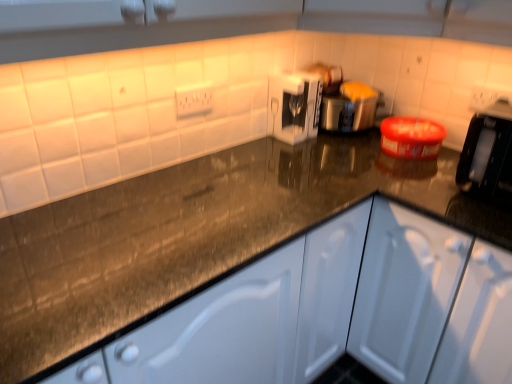
Question: Are satin silver toaster at center, the second appliance in the left-to-right sequence, and white glossy coffee machine at center, which appears as the first appliance when viewed from the left, beside each other?

Choices:
 (A) yes
 (B) no

Answer: (B)

Question: Is satin silver toaster at center, marked as the first appliance in a right-to-left arrangement, not close to white glossy coffee machine at center, which appears as the first appliance when viewed from the left?

Choices:
 (A) yes
 (B) no

Answer: (B)

Question: Considering the relative sizes of satin silver toaster at center, marked as the first appliance in a right-to-left arrangement, and white glossy coffee machine at center, which appears as the first appliance when viewed from the left, in the image provided, is satin silver toaster at center, marked as the first appliance in a right-to-left arrangement, shorter than white glossy coffee machine at center, which appears as the first appliance when viewed from the left,?

Choices:
 (A) no
 (B) yes

Answer: (A)

Question: From a real-world perspective, is satin silver toaster at center, marked as the first appliance in a right-to-left arrangement, on top of white glossy coffee machine at center, which appears as the first appliance when viewed from the left?

Choices:
 (A) no
 (B) yes

Answer: (B)

Question: Considering the relative positions of satin silver toaster at center, marked as the first appliance in a right-to-left arrangement, and white glossy coffee machine at center, placed as the second appliance when sorted from right to left, in the image provided, is satin silver toaster at center, marked as the first appliance in a right-to-left arrangement, to the left of white glossy coffee machine at center, placed as the second appliance when sorted from right to left, from the viewer's perspective?

Choices:
 (A) yes
 (B) no

Answer: (B)

Question: Can you confirm if satin silver toaster at center, the second appliance in the left-to-right sequence, is bigger than white glossy coffee machine at center, which appears as the first appliance when viewed from the left?

Choices:
 (A) no
 (B) yes

Answer: (B)

Question: Considering the relative positions of white plastic electric outlet at upper center and white glossy coffee machine at center, placed as the second appliance when sorted from right to left, in the image provided, is white plastic electric outlet at upper center in front of white glossy coffee machine at center, placed as the second appliance when sorted from right to left,?

Choices:
 (A) no
 (B) yes

Answer: (B)

Question: Considering the relative sizes of white plastic electric outlet at upper center and white glossy coffee machine at center, which appears as the first appliance when viewed from the left, in the image provided, is white plastic electric outlet at upper center smaller than white glossy coffee machine at center, which appears as the first appliance when viewed from the left,?

Choices:
 (A) no
 (B) yes

Answer: (B)

Question: Is white plastic electric outlet at upper center not near white glossy coffee machine at center, which appears as the first appliance when viewed from the left?

Choices:
 (A) yes
 (B) no

Answer: (B)

Question: Would you say white plastic electric outlet at upper center is outside white glossy coffee machine at center, which appears as the first appliance when viewed from the left?

Choices:
 (A) yes
 (B) no

Answer: (A)

Question: From the image's perspective, does white plastic electric outlet at upper center appear higher than white glossy coffee machine at center, which appears as the first appliance when viewed from the left?

Choices:
 (A) no
 (B) yes

Answer: (A)

Question: Is white glossy coffee machine at center, placed as the second appliance when sorted from right to left, inside white plastic electric outlet at upper center?

Choices:
 (A) no
 (B) yes

Answer: (A)

Question: Is white plastic electric outlet at upper center aimed at satin silver toaster at center, the second appliance in the left-to-right sequence?

Choices:
 (A) yes
 (B) no

Answer: (B)